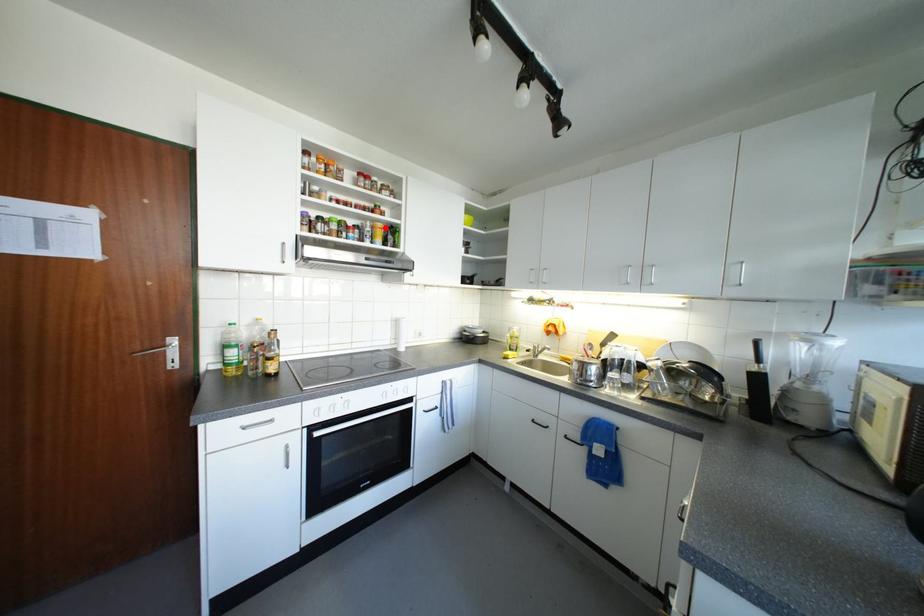
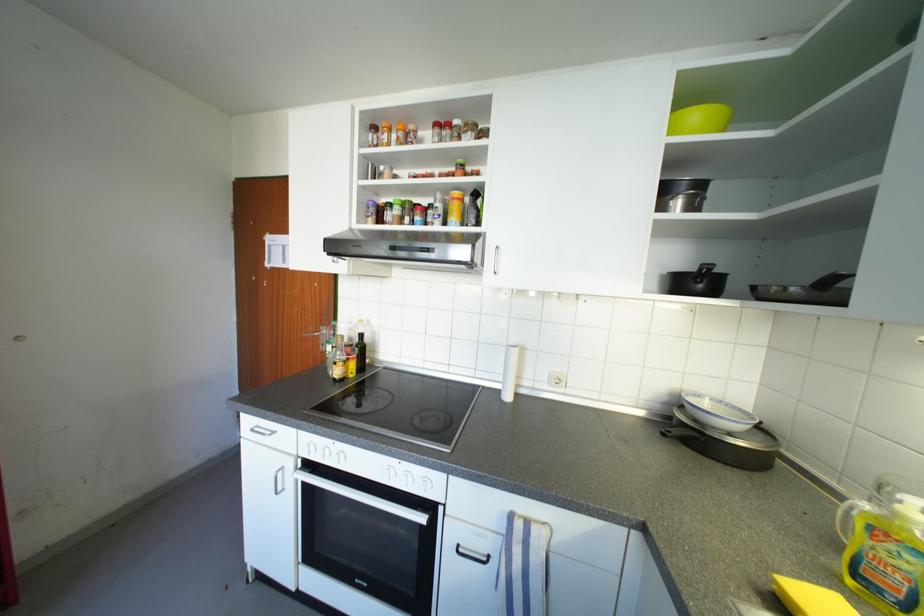
In the second image, find the point that corresponds to the highlighted location in the first image.

(463, 197)